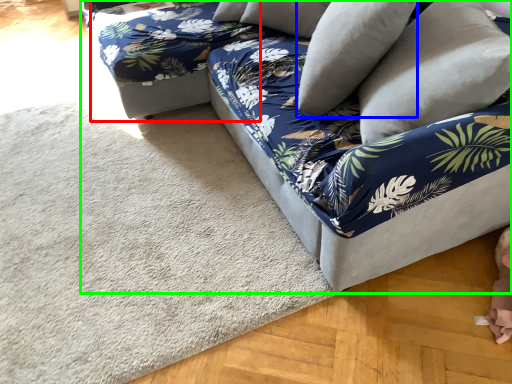
Question: Based on their relative distances, which object is nearer to bean bag chair (highlighted by a red box)? Choose from pillow (highlighted by a blue box) and studio couch (highlighted by a green box).

Choices:
 (A) pillow
 (B) studio couch

Answer: (B)